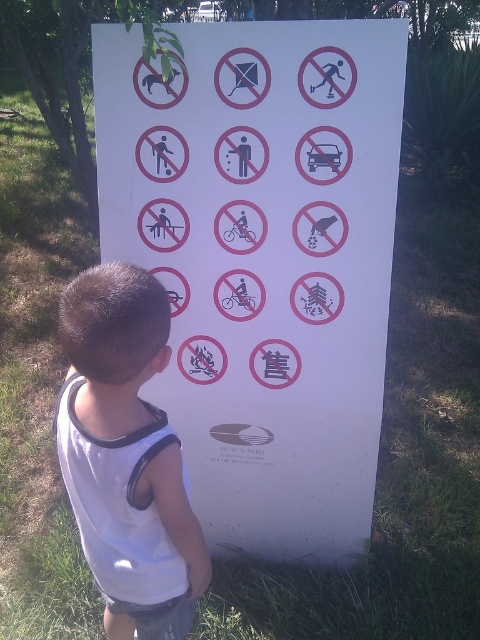
Between white paper sign at center and white fabric shirt at center, which one has more height?

white paper sign at center is taller.

Between white paper sign at center and white fabric shirt at center, which one appears on the right side from the viewer's perspective?

white paper sign at center

You are a GUI agent. You are given a task and a screenshot of the screen. Output one action in this format:
    pyautogui.click(x=<x>, y=<y>)
    Task: Click on the white paper sign at center
    
    Given the screenshot: What is the action you would take?
    pyautogui.click(x=264, y=260)